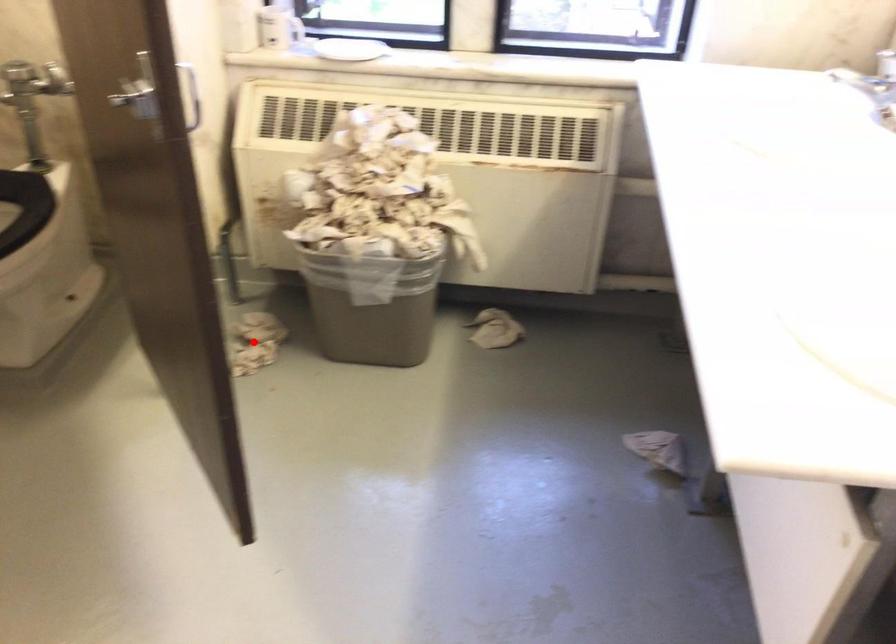
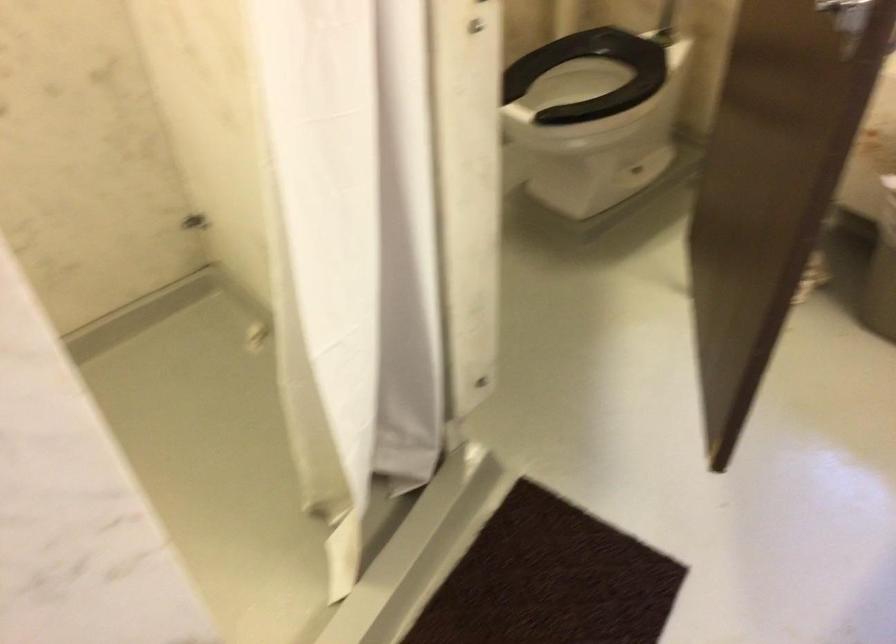
Question: I am providing you with two images of the same scene from different viewpoints. A red point is marked on the first image. Can you still see the location of the red point in image 2?

Choices:
 (A) Yes
 (B) No

Answer: (B)